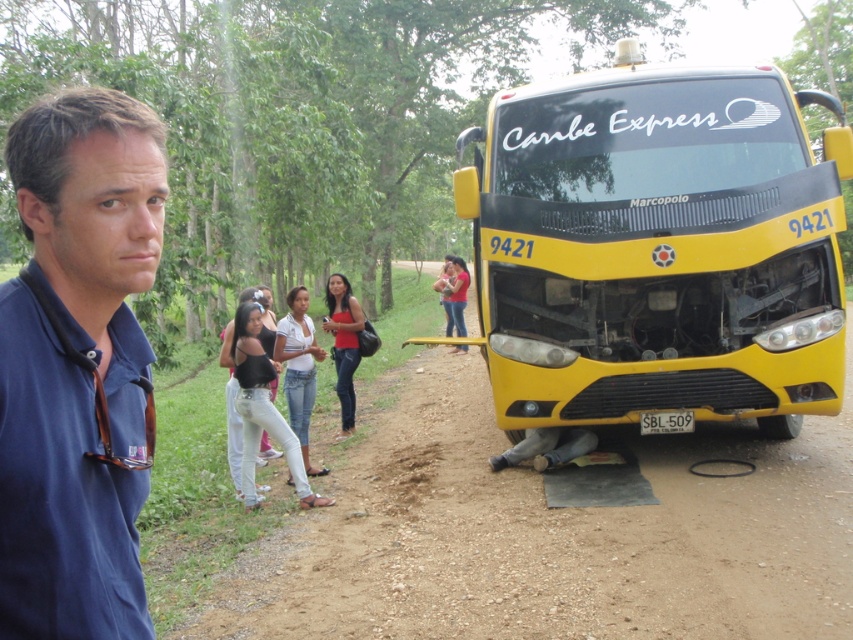
Question: Estimate the real-world distances between objects in this image. Which object is farther from the blue fabric shirt at left?

Choices:
 (A) yellow matte bus at right
 (B) dirt track at center

Answer: (B)

Question: Which object appears closest to the camera in this image?

Choices:
 (A) dirt track at center
 (B) blue fabric shirt at left
 (C) yellow matte bus at right

Answer: (B)

Question: Is dirt track at center to the left of blue fabric shirt at left from the viewer's perspective?

Choices:
 (A) yes
 (B) no

Answer: (B)

Question: Which object appears closest to the camera in this image?

Choices:
 (A) dirt track at center
 (B) yellow matte bus at right

Answer: (B)

Question: Does dirt track at center have a larger size compared to blue fabric shirt at left?

Choices:
 (A) yes
 (B) no

Answer: (B)

Question: Is yellow matte bus at right positioned in front of blue fabric shirt at left?

Choices:
 (A) no
 (B) yes

Answer: (A)